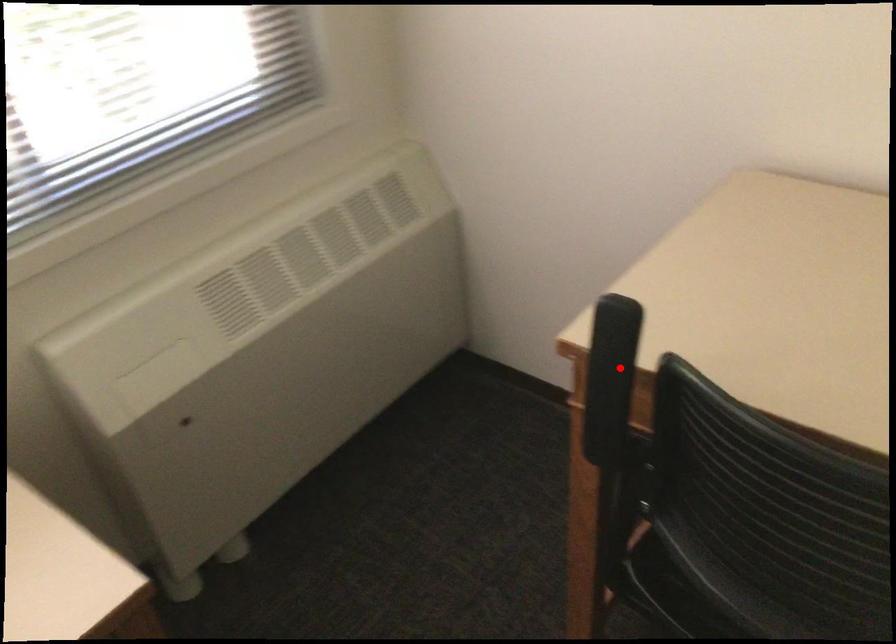
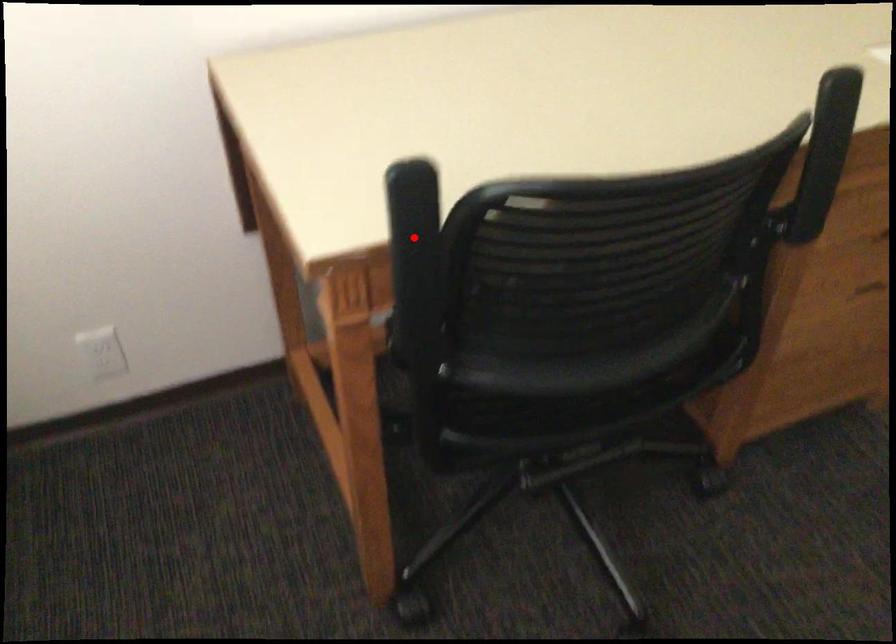
I am providing you with two images of the same scene from different viewpoints. A red point is marked on the first image and another point is marked on the second image. Is the marked point in image1 the same physical position as the marked point in image2?

Yes